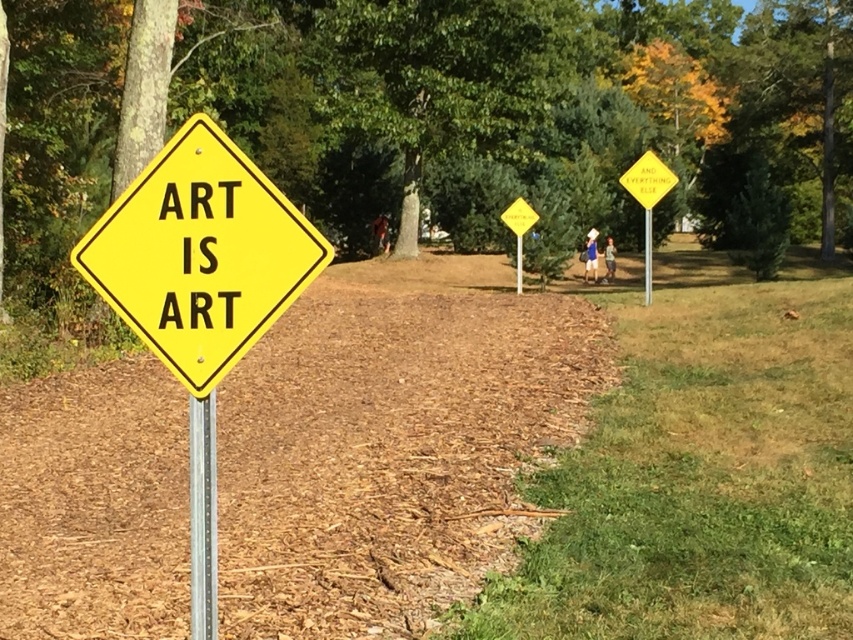
Question: Considering the relative positions of yellow metal pole at center and yellow metal signpost at center in the image provided, where is yellow metal pole at center located with respect to yellow metal signpost at center?

Choices:
 (A) below
 (B) above

Answer: (B)

Question: Is the position of metallic silver pole at center less distant than that of yellow metal signpost at center?

Choices:
 (A) no
 (B) yes

Answer: (B)

Question: Is yellow diamond-shaped sign at left below metallic silver pole at center?

Choices:
 (A) yes
 (B) no

Answer: (B)

Question: Which object is farther from the camera taking this photo?

Choices:
 (A) yellow metal pole at center
 (B) metallic silver pole at center

Answer: (A)

Question: Which of the following is the farthest from the observer?

Choices:
 (A) pos(230,156)
 (B) pos(202,525)
 (C) pos(645,212)

Answer: (C)

Question: Which of the following is the closest to the observer?

Choices:
 (A) metallic silver pole at center
 (B) yellow diamond-shaped sign at left
 (C) yellow metal pole at center

Answer: (B)